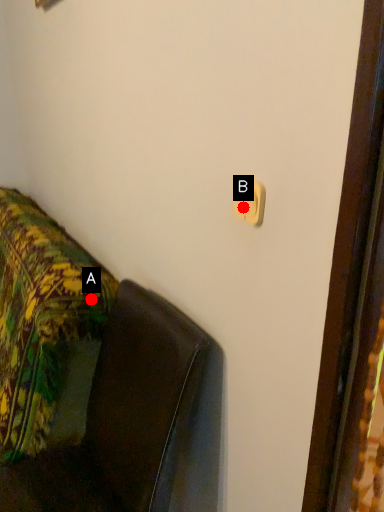
Question: Two points are circled on the image, labeled by A and B beside each circle. Which point is farther from the camera taking this photo?

Choices:
 (A) A is further
 (B) B is further

Answer: (A)